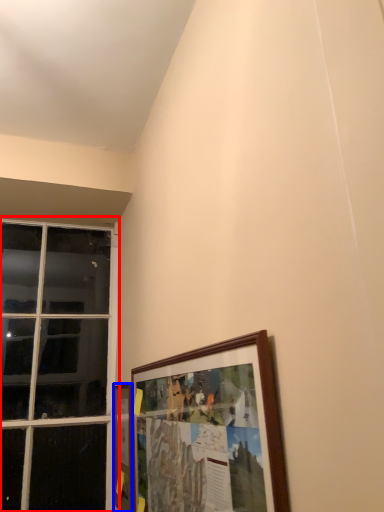
Question: Which of the following is the farthest to the observer, window (highlighted by a red box) or picture frame (highlighted by a blue box)?

Choices:
 (A) window
 (B) picture frame

Answer: (A)